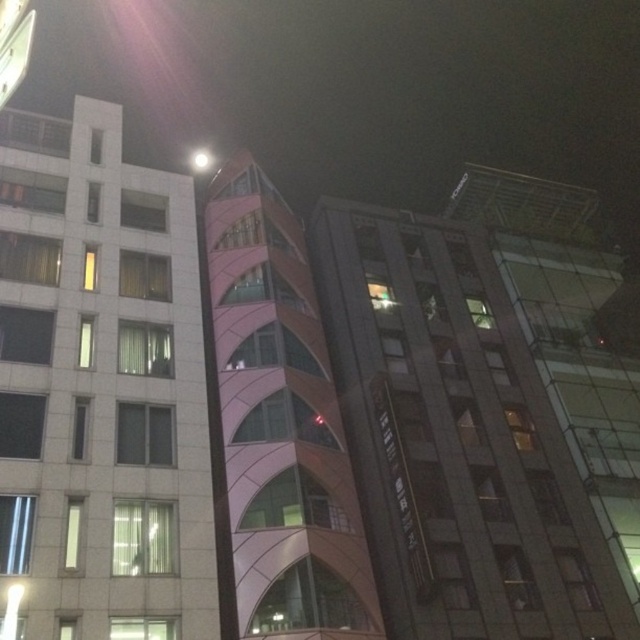
Question: Which of the following is the farthest from the observer?

Choices:
 (A) (637, 547)
 (B) (17, 333)
 (C) (346, 561)

Answer: (A)

Question: Is pink glass building at center thinner than white glossy building at left?

Choices:
 (A) no
 (B) yes

Answer: (A)

Question: Can you confirm if pink glass building at center is wider than pink glass tower at center?

Choices:
 (A) no
 (B) yes

Answer: (B)

Question: Where is pink glass building at center located in relation to pink glass tower at center in the image?

Choices:
 (A) right
 (B) left

Answer: (A)

Question: Which object is closer to the camera taking this photo?

Choices:
 (A) pink glass building at center
 (B) pink glass tower at center

Answer: (B)

Question: Which object is the farthest from the pink glass tower at center?

Choices:
 (A) pink glass building at center
 (B) white glossy building at left

Answer: (A)